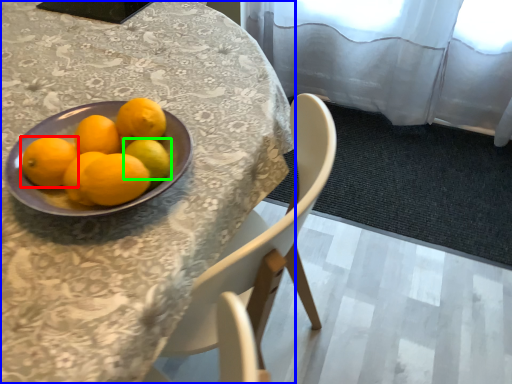
Question: Which object is the closest to the orange (highlighted by a red box)? Choose among these: table (highlighted by a blue box) or lemon (highlighted by a green box).

Choices:
 (A) table
 (B) lemon

Answer: (B)